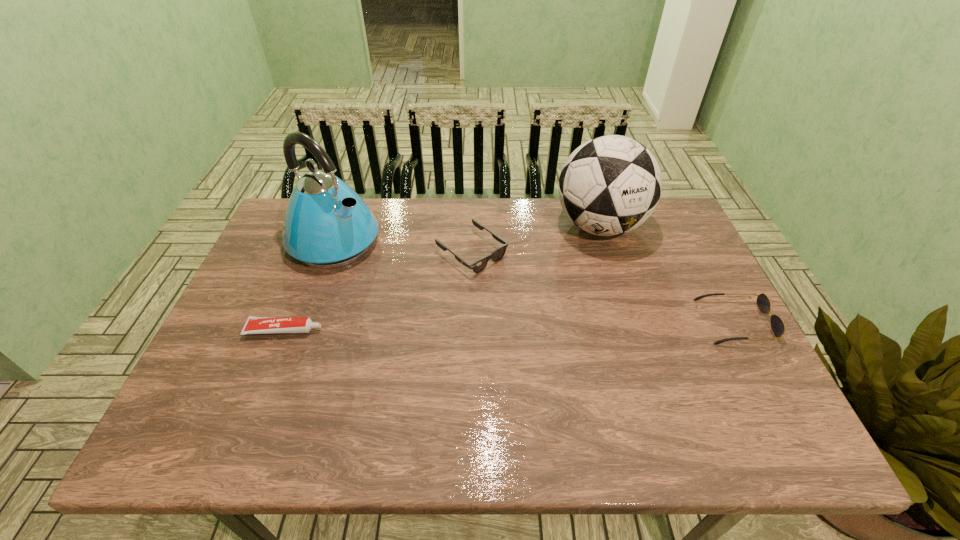
In order to click on free space located on the surface of the fourth object from left to right where the brand logo is visible in this screenshot , I will do `click(580, 297)`.

This screenshot has width=960, height=540. I want to click on free location located 0.110m on the surface of the fourth object from left to right where the brand logo is visible, so point(585,280).

You are a GUI agent. You are given a task and a screenshot of the screen. Output one action in this format:
    pyautogui.click(x=<x>, y=<y>)
    Task: Click on the free spot located at the spout of the tallest object
    This screenshot has width=960, height=540.
    Given the screenshot: What is the action you would take?
    pyautogui.click(x=418, y=290)

You are a GUI agent. You are given a task and a screenshot of the screen. Output one action in this format:
    pyautogui.click(x=<x>, y=<y>)
    Task: Click on the free region located at the spout of the tallest object
    The width and height of the screenshot is (960, 540).
    Given the screenshot: What is the action you would take?
    pyautogui.click(x=422, y=293)

Locate an element on the screen. Image resolution: width=960 pixels, height=540 pixels. free space located at the spout of the tallest object is located at coordinates (415, 288).

Find the location of `free space located on the temples of the left sunglasses`. free space located on the temples of the left sunglasses is located at coordinates (601, 352).

This screenshot has width=960, height=540. I want to click on vacant area located on the temples of the left sunglasses, so click(x=518, y=289).

Where is `free space located on the temples of the left sunglasses`? Image resolution: width=960 pixels, height=540 pixels. free space located on the temples of the left sunglasses is located at coordinates (542, 307).

This screenshot has width=960, height=540. Identify the location of soccer ball that is positioned at the far edge. (610, 185).

Where is `kettle located at the far edge`? kettle located at the far edge is located at coordinates (327, 224).